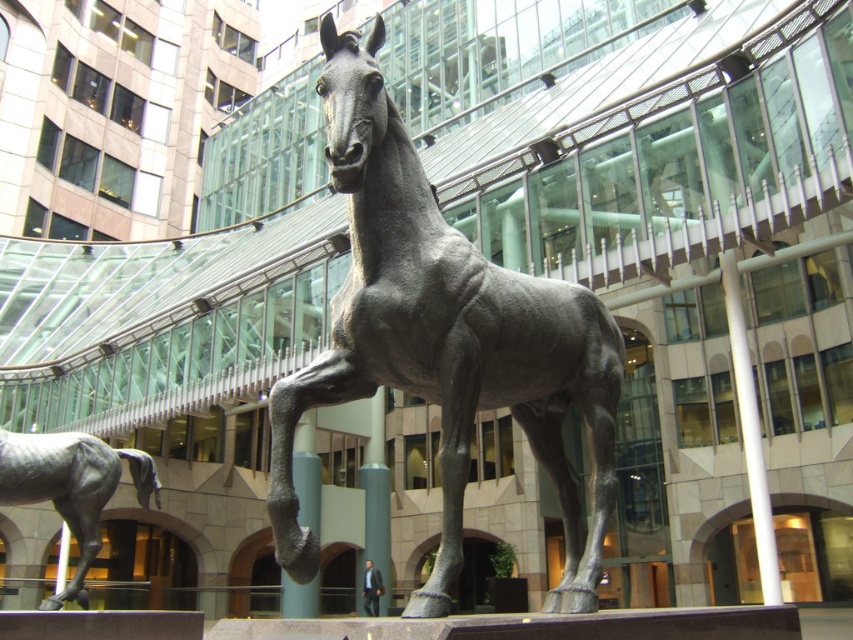
Question: Which of the following is the closest to the observer?

Choices:
 (A) polished white pole at center
 (B) bronze horse at center

Answer: (B)

Question: Which of the following is the closest to the observer?

Choices:
 (A) (753, 401)
 (B) (390, 227)
 (C) (33, 464)

Answer: (B)

Question: Does bronze horse at center have a greater width compared to polished bronze horse at lower left?

Choices:
 (A) yes
 (B) no

Answer: (B)

Question: Which object is positioned farthest from the bronze horse at center?

Choices:
 (A) polished white pole at center
 (B) polished bronze horse at lower left

Answer: (A)

Question: Is bronze horse at center further to the viewer compared to polished bronze horse at lower left?

Choices:
 (A) yes
 (B) no

Answer: (B)

Question: Can you confirm if polished bronze horse at lower left is positioned below polished white pole at center?

Choices:
 (A) yes
 (B) no

Answer: (A)